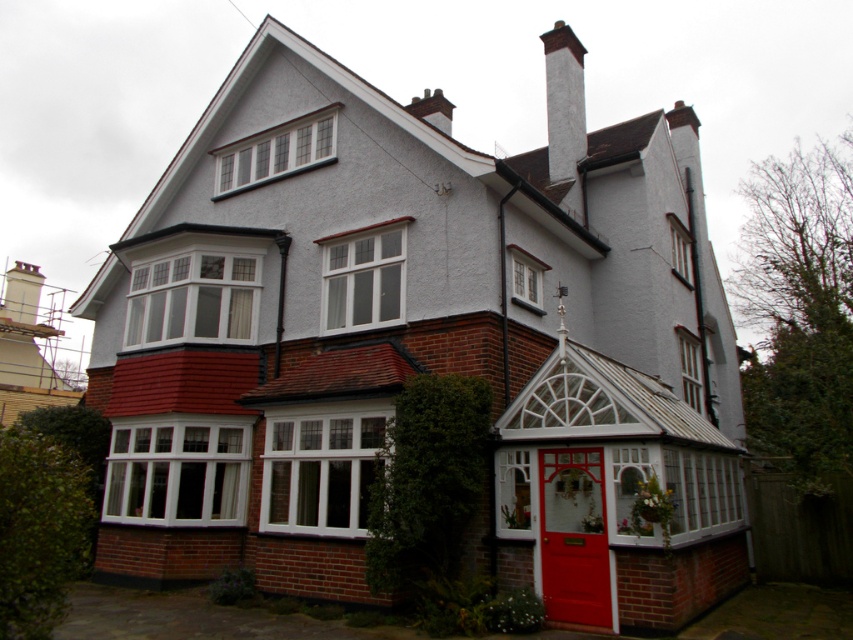
Question: Is white glass conservatory at center smaller than white smooth chimney at upper center?

Choices:
 (A) no
 (B) yes

Answer: (B)

Question: Can you confirm if white glass conservatory at center is positioned to the left of white smooth chimney at upper center?

Choices:
 (A) yes
 (B) no

Answer: (A)

Question: Does white glass conservatory at center have a smaller size compared to white smooth chimney at upper center?

Choices:
 (A) no
 (B) yes

Answer: (B)

Question: Which point is farther to the camera?

Choices:
 (A) white smooth chimney at upper center
 (B) white glass conservatory at center

Answer: (A)

Question: Which point is farther from the camera taking this photo?

Choices:
 (A) (578, 72)
 (B) (552, 506)

Answer: (A)